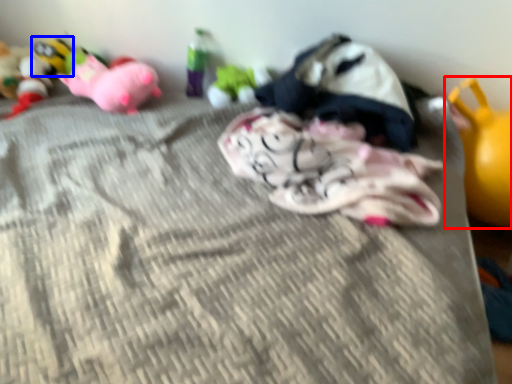
Question: Which point is closer to the camera, toy (highlighted by a red box) or toy (highlighted by a blue box)?

Choices:
 (A) toy
 (B) toy

Answer: (A)